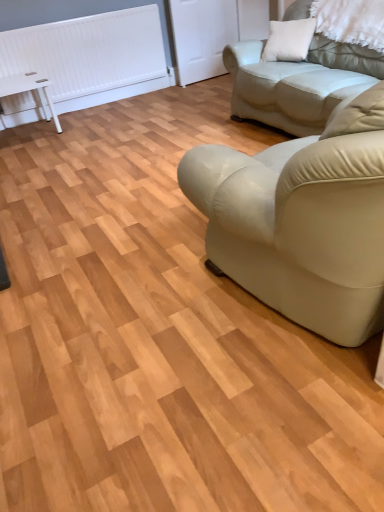
In order to face beige leather couch at right, should I rotate leftwards or rightwards?

Rotate your view right by about 19.172°.

What do you see at coordinates (298, 82) in the screenshot?
I see `beige leather couch at right` at bounding box center [298, 82].

In order to click on beige leather couch at right in this screenshot , I will do `click(298, 82)`.

At what (x,y) coordinates should I click in order to perform the action: click on beige leather couch at right. Please return your answer as a coordinate pair (x, y). The image size is (384, 512). Looking at the image, I should click on (298, 82).